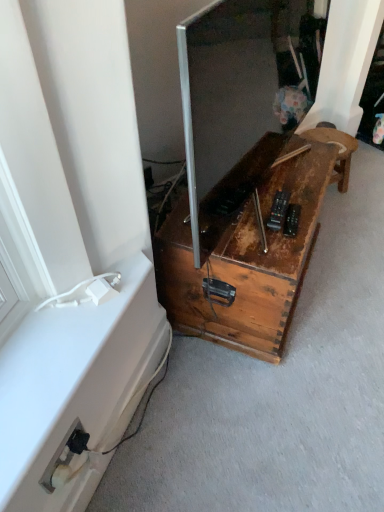
Question: From the image's perspective, does rusty wood trunk at lower right, the 1th furniture in the left-to-right sequence, appear higher than metallic silver screen at center?

Choices:
 (A) no
 (B) yes

Answer: (A)

Question: Would you say rusty wood trunk at lower right, marked as the 2th furniture in a right-to-left arrangement, contains metallic silver screen at center?

Choices:
 (A) no
 (B) yes

Answer: (A)

Question: Considering the relative sizes of rusty wood trunk at lower right, the 1th furniture in the left-to-right sequence, and metallic silver screen at center in the image provided, is rusty wood trunk at lower right, the 1th furniture in the left-to-right sequence, thinner than metallic silver screen at center?

Choices:
 (A) yes
 (B) no

Answer: (B)

Question: Is rusty wood trunk at lower right, marked as the 2th furniture in a right-to-left arrangement, positioned far away from metallic silver screen at center?

Choices:
 (A) no
 (B) yes

Answer: (A)

Question: Can you confirm if rusty wood trunk at lower right, marked as the 2th furniture in a right-to-left arrangement, is positioned to the left of metallic silver screen at center?

Choices:
 (A) no
 (B) yes

Answer: (B)

Question: From the image's perspective, is rusty wood stool at center, which is counted as the first furniture, starting from the right, above or below metallic silver screen at center?

Choices:
 (A) above
 (B) below

Answer: (A)

Question: Relative to metallic silver screen at center, is rusty wood stool at center, placed as the second furniture when sorted from left to right, in front or behind?

Choices:
 (A) behind
 (B) front

Answer: (A)

Question: Considering the positions of rusty wood stool at center, placed as the second furniture when sorted from left to right, and metallic silver screen at center in the image, is rusty wood stool at center, placed as the second furniture when sorted from left to right, taller or shorter than metallic silver screen at center?

Choices:
 (A) short
 (B) tall

Answer: (A)

Question: From a real-world perspective, is rusty wood stool at center, which is counted as the first furniture, starting from the right, physically located above or below metallic silver screen at center?

Choices:
 (A) below
 (B) above

Answer: (A)

Question: Is metallic silver screen at center in front of or behind white plastic electrical outlet at lower left in the image?

Choices:
 (A) front
 (B) behind

Answer: (A)

Question: Based on their positions, is metallic silver screen at center located to the left or right of white plastic electrical outlet at lower left?

Choices:
 (A) left
 (B) right

Answer: (B)

Question: Based on their sizes in the image, would you say metallic silver screen at center is bigger or smaller than white plastic electrical outlet at lower left?

Choices:
 (A) big
 (B) small

Answer: (A)

Question: From a real-world perspective, is metallic silver screen at center physically located above or below white plastic electrical outlet at lower left?

Choices:
 (A) below
 (B) above

Answer: (B)

Question: In terms of height, does rusty wood stool at center, placed as the second furniture when sorted from left to right, look taller or shorter compared to rusty wood trunk at lower right, the 1th furniture in the left-to-right sequence?

Choices:
 (A) tall
 (B) short

Answer: (B)

Question: Is rusty wood stool at center, placed as the second furniture when sorted from left to right, wider or thinner than rusty wood trunk at lower right, the 1th furniture in the left-to-right sequence?

Choices:
 (A) thin
 (B) wide

Answer: (A)